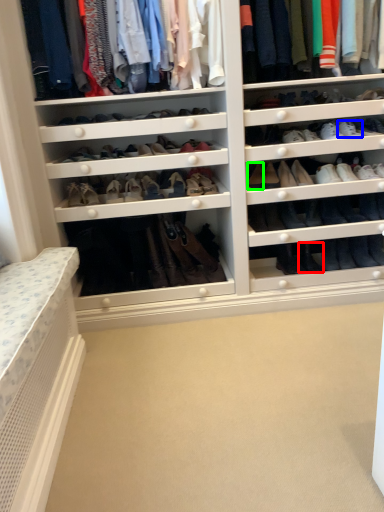
Question: Considering the real-world distances, which object is farthest from shoe (highlighted by a red box)? shoe (highlighted by a blue box) or shoe (highlighted by a green box)?

Choices:
 (A) shoe
 (B) shoe

Answer: (A)